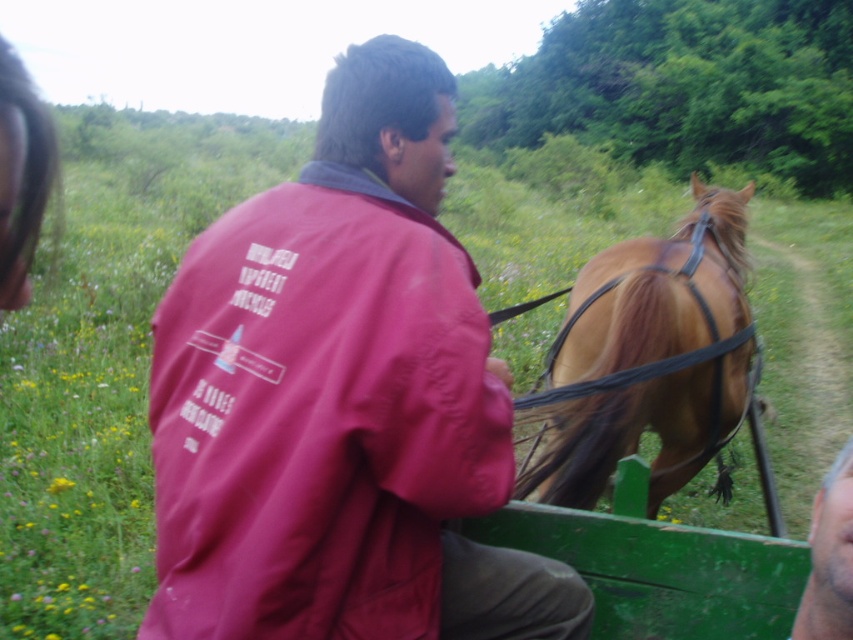
Question: Is matte red jacket at center closer to the viewer compared to shiny brown horse at right?

Choices:
 (A) yes
 (B) no

Answer: (A)

Question: Which object is closer to the camera taking this photo?

Choices:
 (A) shiny brown horse at right
 (B) matte red jacket at center

Answer: (B)

Question: Does matte red jacket at center have a lesser width compared to shiny brown horse at right?

Choices:
 (A) no
 (B) yes

Answer: (B)

Question: Among these objects, which one is nearest to the camera?

Choices:
 (A) shiny brown horse at right
 (B) matte red jacket at center

Answer: (B)

Question: Is matte red jacket at center smaller than shiny brown horse at right?

Choices:
 (A) no
 (B) yes

Answer: (B)